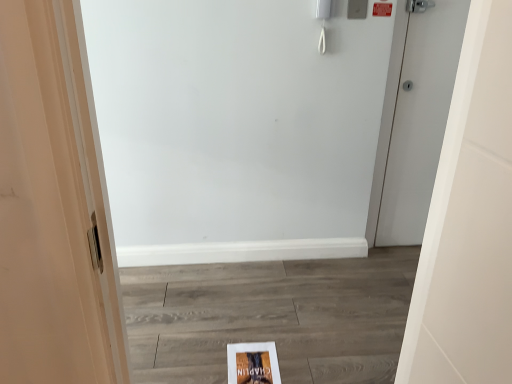
The image size is (512, 384). In order to click on vacant point above matte paper flyer at center (from a real-world perspective) in this screenshot , I will do `click(247, 362)`.